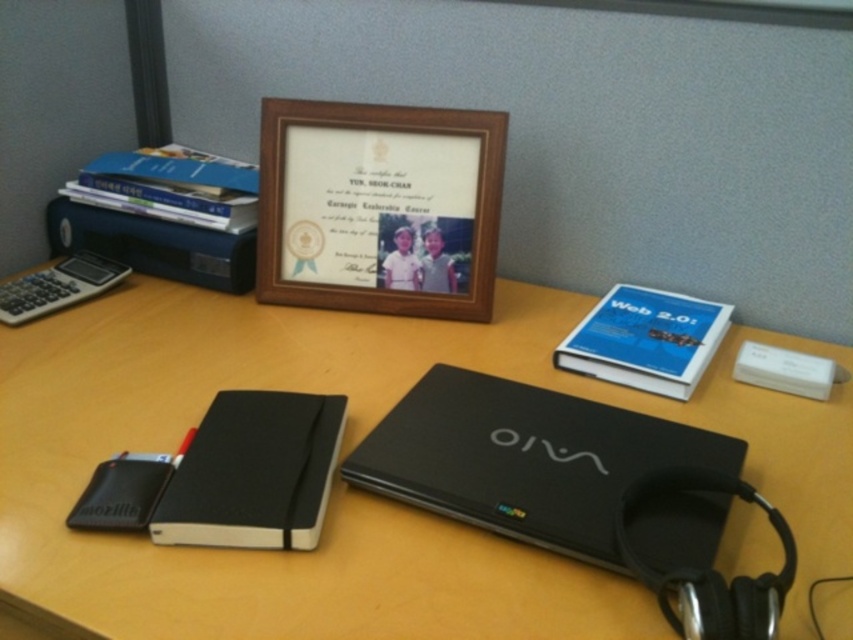
You are organizing your desk and need to place a new item at coordinates 0.7, 0.6. Is there enough space to place it there without overlapping the black matte laptop at center?

The black matte laptop at center is located at coordinates [524,458]. The new item at [511,448] is very close but might overlap depending on the size of the new item and the laptop. However, since the exact dimensions are not provided, it is uncertain. Please check the size of both items before placing.

You are organizing your desk and need to place a new item between the black matte laptop at center and the black matte notebook at center. The item you want to place is 7 inches long. Will there be enough space between them to fit this item?

The black matte laptop at center and black matte notebook at center are 6.84 inches apart. Since the item you want to place is 7 inches long, which is slightly longer than the available space, it will not fit between them.